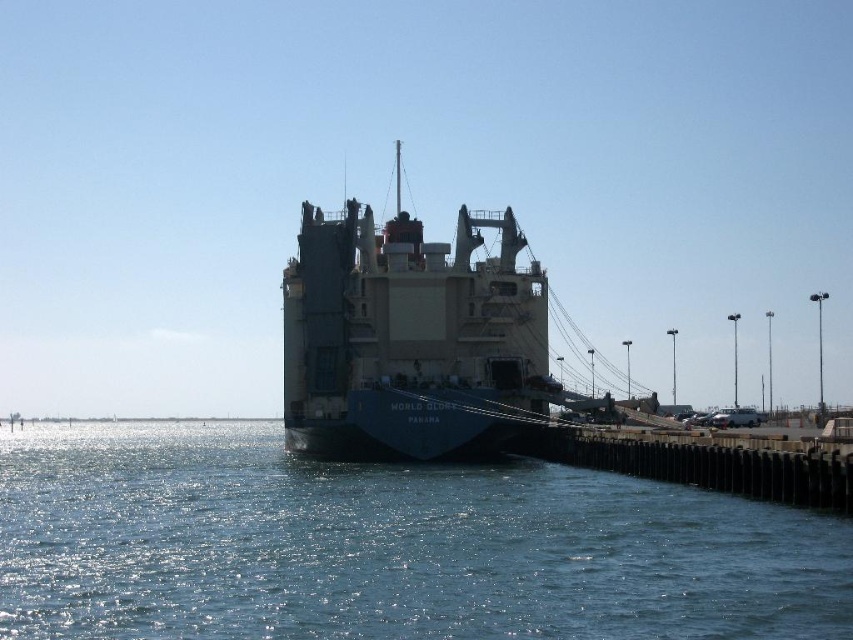
Who is positioned more to the left, blue water at lower left or green matte cargo ship at center?

blue water at lower left is more to the left.

Does blue water at lower left have a lesser width compared to green matte cargo ship at center?

No.

Which is behind, point (728, 563) or point (416, 244)?

The point (416, 244) is more distant.

You are a GUI agent. You are given a task and a screenshot of the screen. Output one action in this format:
    pyautogui.click(x=<x>, y=<y>)
    Task: Click on the blue water at lower left
    Image resolution: width=853 pixels, height=640 pixels.
    Given the screenshot: What is the action you would take?
    pyautogui.click(x=387, y=547)